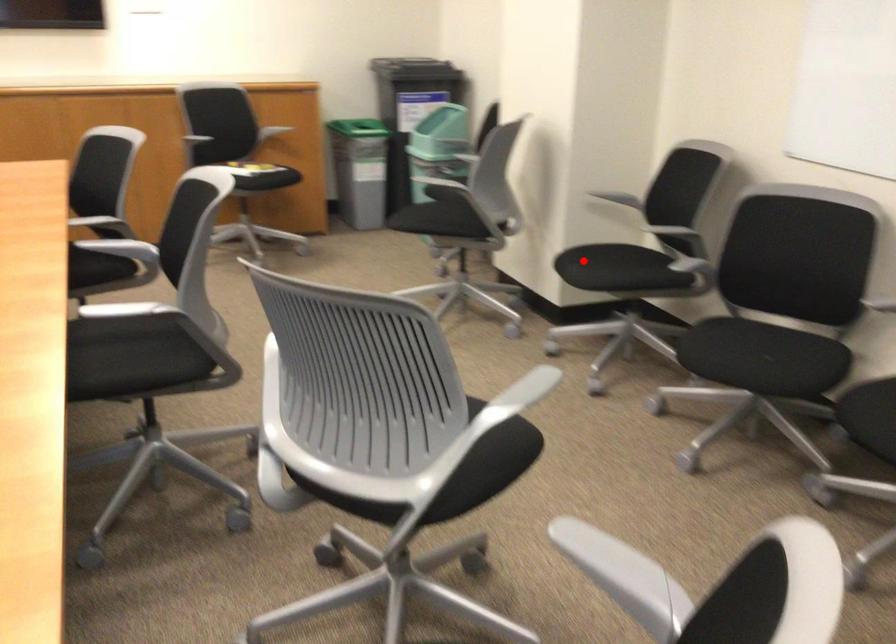
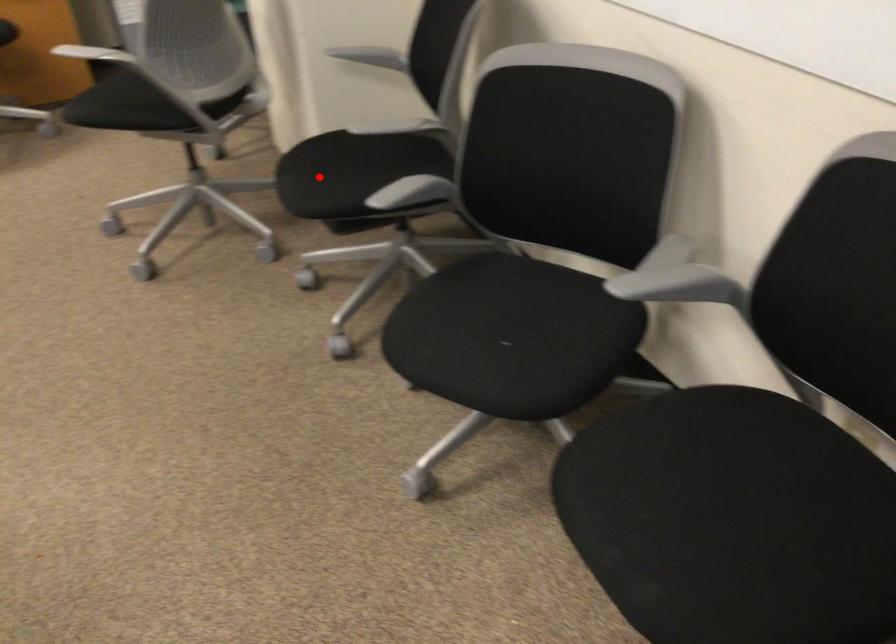
I am providing you with two images of the same scene from different viewpoints. A red point is marked on the first image and another point is marked on the second image. Is the marked point in image1 the same physical position as the marked point in image2?

Yes